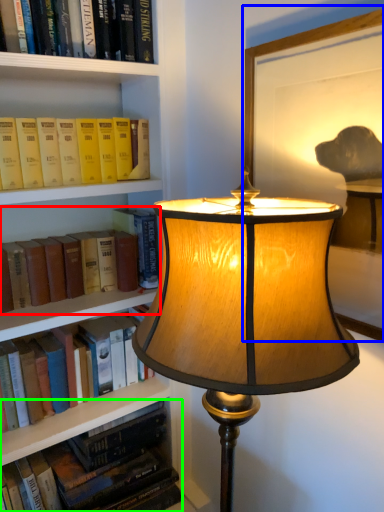
Question: Considering the real-world distances, which object is closest to book (highlighted by a red box)? picture frame (highlighted by a blue box) or book (highlighted by a green box).

Choices:
 (A) picture frame
 (B) book

Answer: (B)